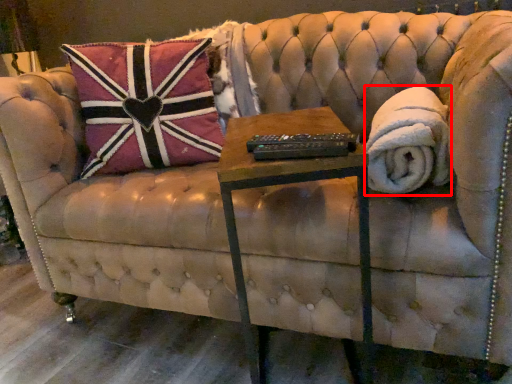
Question: Considering the relative positions of blanket (annotated by the red box) and table in the image provided, where is blanket (annotated by the red box) located with respect to the staircase?

Choices:
 (A) left
 (B) right

Answer: (B)